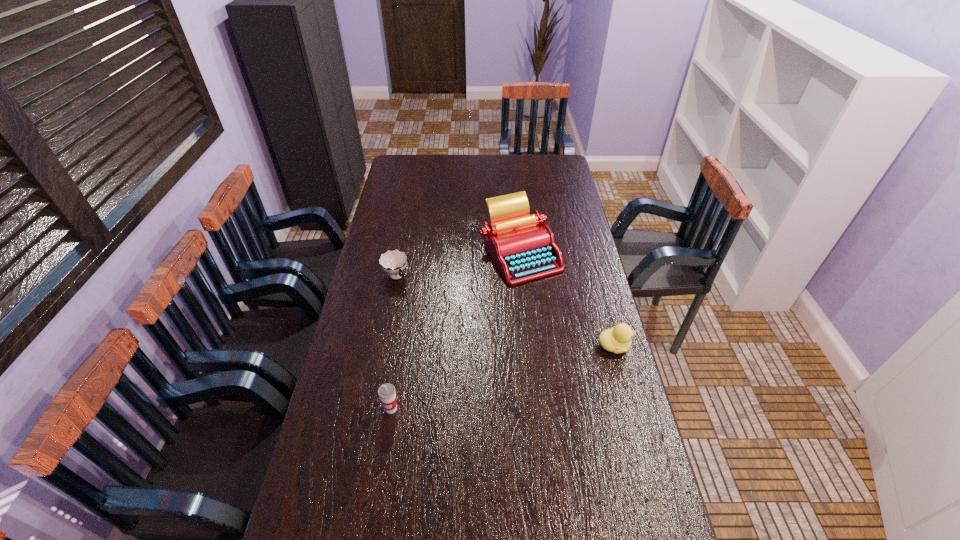
This screenshot has width=960, height=540. What are the coordinates of `vacant space that's between the typewriter and the nearer cup` in the screenshot? It's located at coord(456,331).

Locate an element on the screen. free space between the farther cup and the typewriter is located at coordinates (458, 265).

The image size is (960, 540). Identify the location of empty space that is in between the duckling and the third object from left to right. (567, 300).

Identify the location of object that is the closest to the shorter cup. (522, 246).

This screenshot has height=540, width=960. In order to click on object that can be found as the second closest to the third object from left to right in this screenshot , I will do click(393, 262).

Locate an element on the screen. vacant position in the image that satisfies the following two spatial constraints: 1. on the front side of the duckling; 2. at the beak of the shorter cup is located at coordinates (382, 346).

You are a GUI agent. You are given a task and a screenshot of the screen. Output one action in this format:
    pyautogui.click(x=<x>, y=<y>)
    Task: Click on the vacant area that satisfies the following two spatial constraints: 1. on the front side of the second nearest object; 2. at the beak of the typewriter
    
    Given the screenshot: What is the action you would take?
    pyautogui.click(x=529, y=346)

This screenshot has height=540, width=960. What are the coordinates of `free space that satisfies the following two spatial constraints: 1. on the front side of the farther cup; 2. at the beak of the rightmost object` in the screenshot? It's located at (382, 346).

Find the location of a particular element. The width and height of the screenshot is (960, 540). free spot that satisfies the following two spatial constraints: 1. on the front side of the tallest object; 2. at the beak of the duckling is located at coordinates (529, 346).